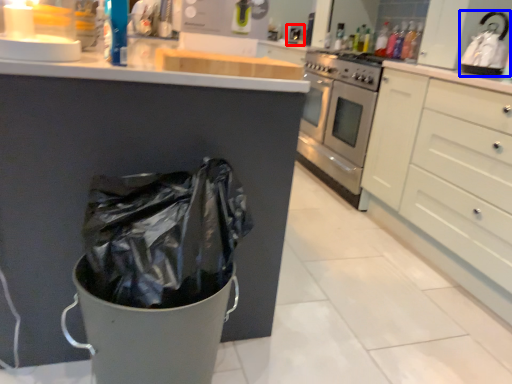
Question: Among these objects, which one is nearest to the camera, sink (highlighted by a red box) or appliance (highlighted by a blue box)?

Choices:
 (A) sink
 (B) appliance

Answer: (B)